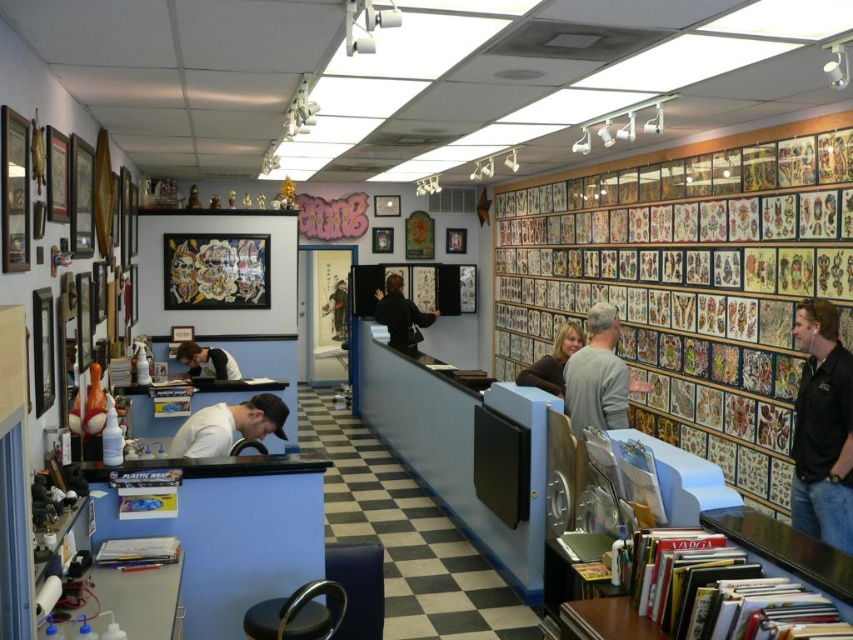
Does point (619, 392) come behind point (268, 419)?

That is True.

Consider the image. Between gray sweater at center and white matte shirt at lower left, which one is positioned higher?

gray sweater at center is higher up.

The height and width of the screenshot is (640, 853). What do you see at coordinates (596, 376) in the screenshot?
I see `gray sweater at center` at bounding box center [596, 376].

Find the location of a particular element. The image size is (853, 640). gray sweater at center is located at coordinates (596, 376).

Is point (560, 349) closer to viewer compared to point (241, 376)?

Yes, point (560, 349) is in front of point (241, 376).

Which is behind, point (520, 380) or point (202, 358)?

The point (202, 358) is behind.

Image resolution: width=853 pixels, height=640 pixels. I want to click on matte brown hair at center, so click(553, 362).

Does point (186, 452) lie behind point (286, 600)?

Yes, it is behind point (286, 600).

This screenshot has width=853, height=640. In order to click on white matte shirt at lower left in this screenshot , I will do `click(228, 426)`.

Find the location of a particular element. Image resolution: width=853 pixels, height=640 pixels. white matte shirt at lower left is located at coordinates (228, 426).